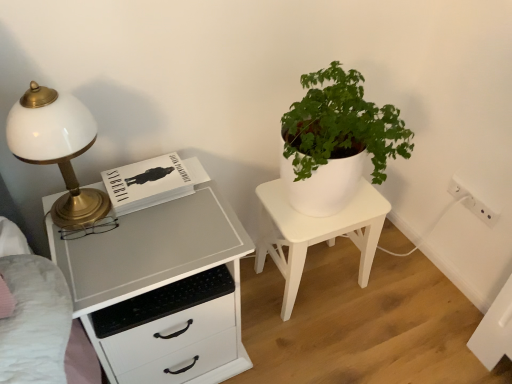
Question: Is white glossy chest of drawers at left positioned beyond the bounds of white glossy lamp at left?

Choices:
 (A) yes
 (B) no

Answer: (A)

Question: Is white glossy chest of drawers at left to the right of white glossy lamp at left from the viewer's perspective?

Choices:
 (A) no
 (B) yes

Answer: (B)

Question: Are white glossy chest of drawers at left and white glossy lamp at left beside each other?

Choices:
 (A) no
 (B) yes

Answer: (A)

Question: From a real-world perspective, is white glossy chest of drawers at left located higher than white glossy lamp at left?

Choices:
 (A) no
 (B) yes

Answer: (A)

Question: Does white glossy chest of drawers at left have a greater width compared to white glossy lamp at left?

Choices:
 (A) no
 (B) yes

Answer: (B)

Question: Based on their positions, is white matte/porcelain nightstand at center located to the left or right of white glossy lamp at left?

Choices:
 (A) left
 (B) right

Answer: (B)

Question: Would you say white matte/porcelain nightstand at center is inside or outside white glossy lamp at left?

Choices:
 (A) inside
 (B) outside

Answer: (B)

Question: Considering the positions of white matte/porcelain nightstand at center and white glossy lamp at left in the image, is white matte/porcelain nightstand at center taller or shorter than white glossy lamp at left?

Choices:
 (A) tall
 (B) short

Answer: (A)

Question: Based on their sizes in the image, would you say white matte/porcelain nightstand at center is bigger or smaller than white glossy lamp at left?

Choices:
 (A) small
 (B) big

Answer: (B)

Question: From a real-world perspective, is white plastic electric outlet at lower right above or below white glossy lamp at left?

Choices:
 (A) below
 (B) above

Answer: (A)

Question: In terms of height, does white plastic electric outlet at lower right look taller or shorter compared to white glossy lamp at left?

Choices:
 (A) short
 (B) tall

Answer: (A)

Question: From the image's perspective, is white plastic electric outlet at lower right positioned above or below white glossy lamp at left?

Choices:
 (A) above
 (B) below

Answer: (B)

Question: Considering the positions of point (492, 226) and point (67, 142), is point (492, 226) closer or farther from the camera than point (67, 142)?

Choices:
 (A) closer
 (B) farther

Answer: (B)

Question: From the image's perspective, is white glossy chest of drawers at left located above or below white matte/porcelain nightstand at center?

Choices:
 (A) above
 (B) below

Answer: (B)

Question: From a real-world perspective, is white glossy chest of drawers at left physically located above or below white matte/porcelain nightstand at center?

Choices:
 (A) below
 (B) above

Answer: (B)